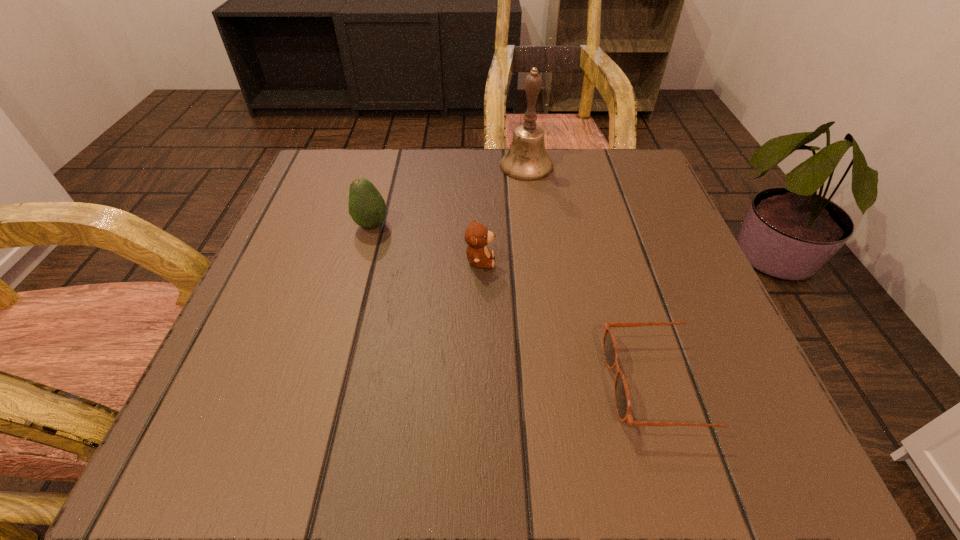
You are a GUI agent. You are given a task and a screenshot of the screen. Output one action in this format:
    pyautogui.click(x=<x>, y=<y>)
    Task: Click on the second object from right to left
    This screenshot has height=540, width=960.
    Given the screenshot: What is the action you would take?
    pyautogui.click(x=527, y=160)

Identify the location of the farthest object. (527, 160).

Identify the location of the leftmost object. (367, 207).

Where is `avocado`? The width and height of the screenshot is (960, 540). avocado is located at coordinates (367, 207).

Where is `teddy bear`? teddy bear is located at coordinates (477, 236).

You are a GUI agent. You are given a task and a screenshot of the screen. Output one action in this format:
    pyautogui.click(x=<x>, y=<y>)
    Task: Click on the third farthest object
    
    Given the screenshot: What is the action you would take?
    pyautogui.click(x=477, y=236)

The width and height of the screenshot is (960, 540). Find the location of `the rightmost object`. the rightmost object is located at coordinates (623, 406).

The image size is (960, 540). I want to click on sunglasses, so [623, 406].

You are a GUI agent. You are given a task and a screenshot of the screen. Output one action in this format:
    pyautogui.click(x=<x>, y=<y>)
    Task: Click on the vacant region located 0.200m on the left of the second object from right to left
    
    Given the screenshot: What is the action you would take?
    pyautogui.click(x=413, y=166)

Where is `vacant space located on the right of the leftmost object`? vacant space located on the right of the leftmost object is located at coordinates (536, 225).